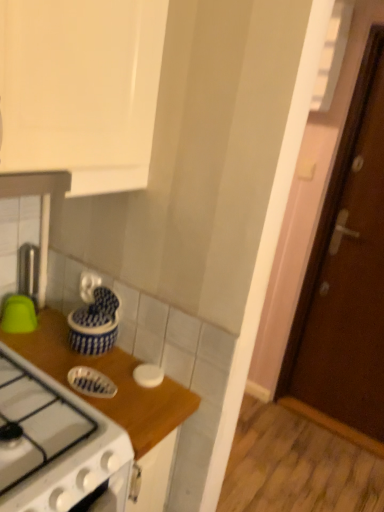
Question: Looking at their shapes, would you say wooden at upper right is wider or thinner than brown wooden door at right?

Choices:
 (A) wide
 (B) thin

Answer: (A)

Question: Is wooden at upper right taller or shorter than brown wooden door at right?

Choices:
 (A) short
 (B) tall

Answer: (A)

Question: Estimate the real-world distances between objects in this image. Which object is closer to the green matte bowl at left, acting as the fourth kitchen appliance starting from the right?

Choices:
 (A) blue glossy dish at center, the 3th kitchen appliance from the left
 (B) wooden at upper right
 (C) brown wooden door at right
 (D) blue glossy jar at center, which ranks as the third kitchen appliance in right-to-left order
 (E) white matte lid at center, which is counted as the first kitchen appliance, starting from the right

Answer: (D)

Question: Which is nearer to the blue glossy jar at center, which is counted as the second kitchen appliance, starting from the left?

Choices:
 (A) brown wooden door at right
 (B) blue glossy dish at center, arranged as the 2th kitchen appliance when viewed from the right
 (C) green matte bowl at left, acting as the fourth kitchen appliance starting from the right
 (D) wooden at upper right
 (E) white matte lid at center, which is counted as the first kitchen appliance, starting from the right

Answer: (D)